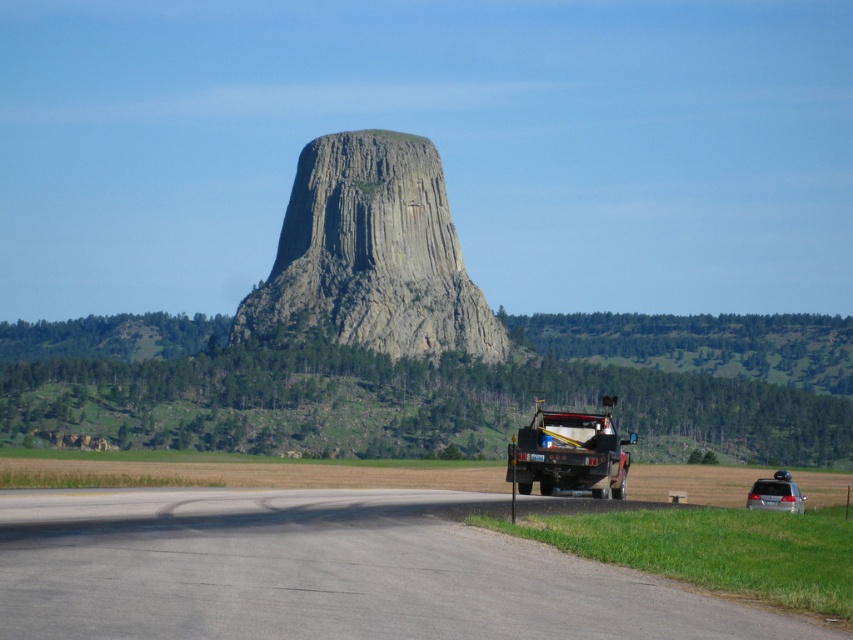
Question: Among these objects, which one is nearest to the camera?

Choices:
 (A) satin silver sedan at lower right
 (B) brushed metal tow truck at center
 (C) gray asphalt highway at center

Answer: (C)

Question: Considering the real-world distances, which object is farthest from the satin silver sedan at lower right?

Choices:
 (A) gray rock formation at center
 (B) gray asphalt highway at center

Answer: (A)

Question: Estimate the real-world distances between objects in this image. Which object is closer to the satin silver sedan at lower right?

Choices:
 (A) gray rock formation at center
 (B) gray asphalt highway at center
 (C) brushed metal tow truck at center

Answer: (C)

Question: Is brushed metal tow truck at center positioned before satin silver sedan at lower right?

Choices:
 (A) yes
 (B) no

Answer: (A)

Question: In this image, where is gray rock formation at center located relative to satin silver sedan at lower right?

Choices:
 (A) above
 (B) below

Answer: (A)

Question: Where is gray asphalt highway at center located in relation to satin silver sedan at lower right in the image?

Choices:
 (A) below
 (B) above

Answer: (B)